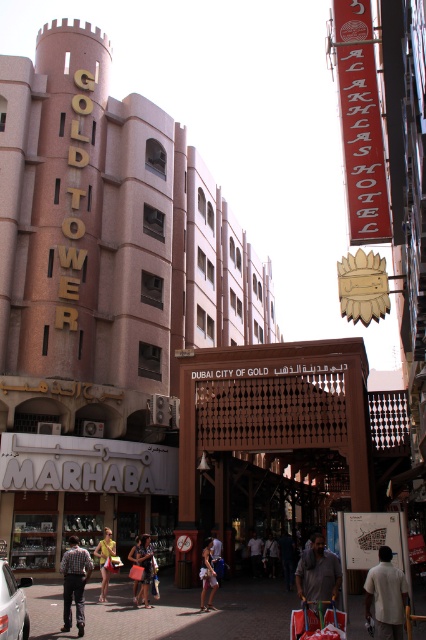
You are a street performer standing on the bustling street in Dubai City of Gold. You see both the dark blue jeans at center and the matte pink dress at center in the crowd. Which one is closer to you?

The distance between the dark blue jeans at center and the matte pink dress at center is 15.38 meters, so neither is closer since they are both at the center and equidistant from your position.